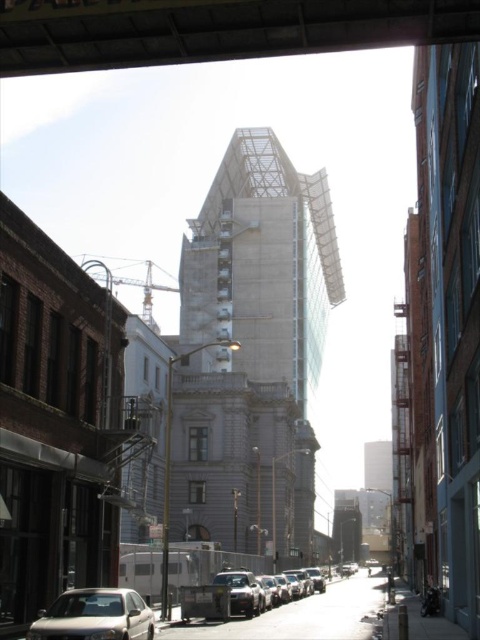
The width and height of the screenshot is (480, 640). What are the coordinates of `metallic glass tower at center` in the screenshot? It's located at (252, 353).

Is metallic glass tower at center below metallic silver car at center?

Incorrect, metallic glass tower at center is not positioned below metallic silver car at center.

Consider the image. Who is more distant from viewer, (216, 244) or (300, 577)?

Point (216, 244)

The height and width of the screenshot is (640, 480). In order to click on metallic glass tower at center in this screenshot , I will do `click(252, 353)`.

Locate an element on the screen. metallic glass tower at center is located at coordinates (252, 353).

Where is `metallic glass tower at center`? metallic glass tower at center is located at coordinates (252, 353).

Locate an element on the screen. This screenshot has width=480, height=640. metallic glass tower at center is located at coordinates (252, 353).

Who is higher up, metal at upper center or metallic silver car at center?

metal at upper center is higher up.

Who is positioned more to the right, metal at upper center or metallic silver car at center?

metallic silver car at center is more to the right.

Is point (20, 19) positioned behind point (247, 570)?

No, it is in front of (247, 570).

At what (x,y) coordinates should I click in order to perform the action: click on metal at upper center. Please return your answer as a coordinate pair (x, y). The image size is (480, 640). Looking at the image, I should click on (214, 29).